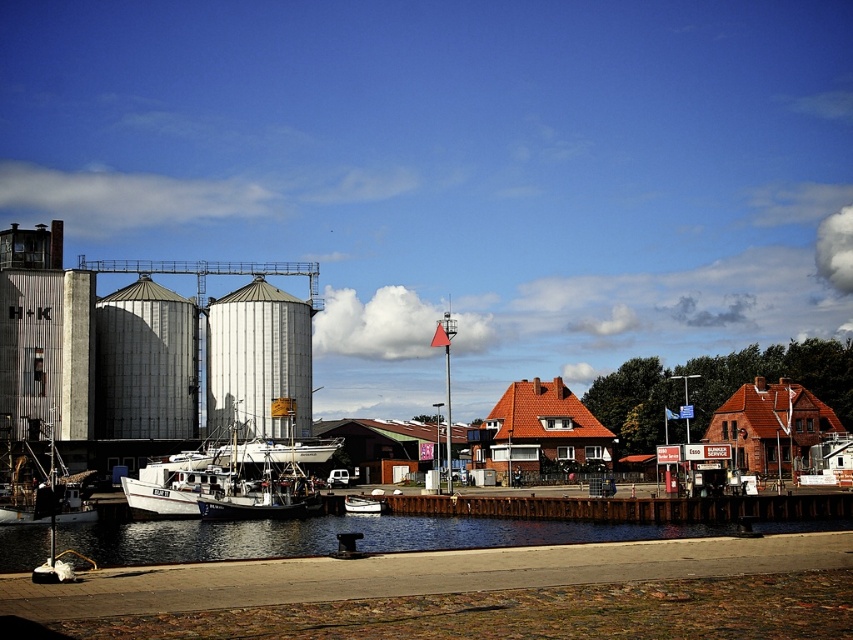
Is white metallic silo at center-left above brown wooden dock at center?

Correct, white metallic silo at center-left is located above brown wooden dock at center.

Between point (254, 355) and point (653, 506), which one is positioned behind?

Positioned behind is point (254, 355).

Image resolution: width=853 pixels, height=640 pixels. What do you see at coordinates (257, 362) in the screenshot?
I see `white metallic silo at center-left` at bounding box center [257, 362].

Find the location of a particular element. Image resolution: width=853 pixels, height=640 pixels. white metallic silo at center-left is located at coordinates (257, 362).

Can you confirm if brown wooden dock at center is positioned above white wooden boat at center?

Correct, brown wooden dock at center is located above white wooden boat at center.

Which is more to the left, brown wooden dock at center or white wooden boat at center?

Positioned to the left is white wooden boat at center.

Image resolution: width=853 pixels, height=640 pixels. I want to click on brown wooden dock at center, so click(630, 508).

Identify the location of brown wooden dock at center. Image resolution: width=853 pixels, height=640 pixels. (630, 508).

Locate an element on the screen. The width and height of the screenshot is (853, 640). white metallic silo at center-left is located at coordinates (257, 362).

Does point (259, 403) come in front of point (376, 513)?

That is False.

The height and width of the screenshot is (640, 853). In order to click on white metallic silo at center-left in this screenshot , I will do `click(257, 362)`.

I want to click on white metallic silo at center-left, so click(257, 362).